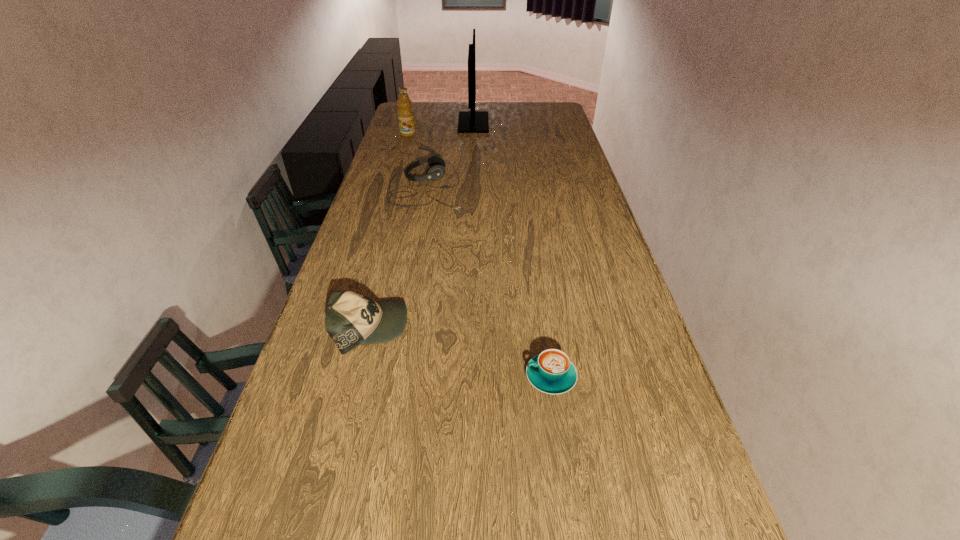
Where is `the tallest object`? This screenshot has height=540, width=960. the tallest object is located at coordinates (472, 121).

Locate an element on the screen. The width and height of the screenshot is (960, 540). olive oil is located at coordinates (405, 112).

Find the location of a particular element. The width and height of the screenshot is (960, 540). the third nearest object is located at coordinates (437, 164).

Where is `baseball cap`? baseball cap is located at coordinates (351, 319).

Identify the location of the shortest object. The image size is (960, 540). (551, 371).

Locate an element on the screen. The height and width of the screenshot is (540, 960). the rightmost object is located at coordinates (551, 371).

Find the location of a particular element. vacant region located on the screen side of the tallest object is located at coordinates (528, 123).

Where is `vacant point located on the label of the fourth shortest object`? vacant point located on the label of the fourth shortest object is located at coordinates (402, 153).

You are a GUI agent. You are given a task and a screenshot of the screen. Output one action in this format:
    pyautogui.click(x=<x>, y=<y>)
    Task: Click on the vacant region located 0.310m on the outer surface of the third farthest object
    
    Given the screenshot: What is the action you would take?
    pyautogui.click(x=544, y=186)

I want to click on vacant space located 0.220m on the front-facing side of the baseball cap, so click(494, 328).